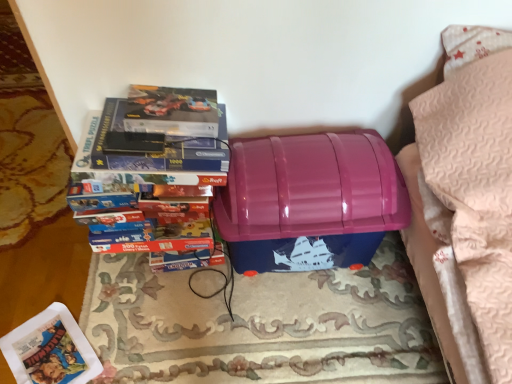
This screenshot has height=384, width=512. Describe the element at coordinates (153, 189) in the screenshot. I see `blue cardboard puzzle at left` at that location.

The image size is (512, 384). I want to click on glossy plastic storage box at center, so click(x=309, y=201).

Based on the photo, from the image's perspective, which object appears higher, blue cardboard puzzle at left or rug/carpet at center?

blue cardboard puzzle at left is shown above in the image.

Can you confirm if blue cardboard puzzle at left is smaller than rug/carpet at center?

No, blue cardboard puzzle at left is not smaller than rug/carpet at center.

Which is farther, (196, 215) or (194, 359)?

The point (194, 359) is more distant.

Is blue cardboard puzzle at left not inside rug/carpet at center?

blue cardboard puzzle at left is positioned outside rug/carpet at center.

Is matte plastic paperback book at lower left shorter than glossy plastic storage box at center?

Indeed, matte plastic paperback book at lower left has a lesser height compared to glossy plastic storage box at center.

From the picture: Does matte plastic paperback book at lower left come behind glossy plastic storage box at center?

Yes, it is behind glossy plastic storage box at center.

Which of these two, matte plastic paperback book at lower left or glossy plastic storage box at center, is wider?

Wider between the two is glossy plastic storage box at center.

How distant is matte plastic paperback book at lower left from glossy plastic storage box at center?

matte plastic paperback book at lower left and glossy plastic storage box at center are 72.64 centimeters apart from each other.

Is rug/carpet at center shorter than glossy plastic storage box at center?

Correct, rug/carpet at center is not as tall as glossy plastic storage box at center.

Does point (362, 319) come behind point (227, 237)?

Yes, point (362, 319) is farther from viewer.

Is rug/carpet at center aimed at glossy plastic storage box at center?

No, rug/carpet at center is not aimed at glossy plastic storage box at center.

From a real-world perspective, who is located higher, matte plastic paperback book at lower left or rug/carpet at center?

From a 3D spatial view, rug/carpet at center is above.

Does matte plastic paperback book at lower left have a smaller size compared to rug/carpet at center?

Indeed, matte plastic paperback book at lower left has a smaller size compared to rug/carpet at center.

Considering their positions, is matte plastic paperback book at lower left located in front of or behind rug/carpet at center?

Visually, matte plastic paperback book at lower left is located behind rug/carpet at center.

Is point (293, 159) positioned after point (362, 297)?

That is False.

Is glossy plastic storage box at center situated inside rug/carpet at center or outside?

glossy plastic storage box at center exists outside the volume of rug/carpet at center.

Between glossy plastic storage box at center and rug/carpet at center, which one has more height?

Standing taller between the two is glossy plastic storage box at center.

Which object is more forward, glossy plastic storage box at center or rug/carpet at center?

Positioned in front is glossy plastic storage box at center.

Does point (156, 243) appear closer or farther from the camera than point (373, 165)?

Point (156, 243).

From a real-world perspective, between blue cardboard puzzle at left and glossy plastic storage box at center, who is vertically higher?

blue cardboard puzzle at left, from a real-world perspective.

From the image's perspective, which one is positioned higher, blue cardboard puzzle at left or glossy plastic storage box at center?

blue cardboard puzzle at left.

Looking at this image, does rug/carpet at center have a larger size compared to blue cardboard puzzle at left?

No.

Can you see rug/carpet at center touching blue cardboard puzzle at left?

No, rug/carpet at center is not making contact with blue cardboard puzzle at left.

Between point (360, 276) and point (93, 159), which one is positioned behind?

The point (360, 276) is farther from the camera.

Can you tell me how much rug/carpet at center and blue cardboard puzzle at left differ in facing direction?

rug/carpet at center and blue cardboard puzzle at left are facing 179 degrees away from each other.

This screenshot has width=512, height=384. Find the location of `mat that is behind the blue cardboard puzzle at left`. mat that is behind the blue cardboard puzzle at left is located at coordinates (262, 325).

Identify the location of paperback book on the left side of glossy plastic storage box at center. The image size is (512, 384). (50, 350).

From the image, which object appears to be nearer to glossy plastic storage box at center, matte plastic paperback book at lower left or rug/carpet at center?

Based on the image, rug/carpet at center appears to be nearer to glossy plastic storage box at center.

Looking at the image, which one is located closer to glossy plastic storage box at center, rug/carpet at center or blue cardboard puzzle at left?

blue cardboard puzzle at left is positioned closer to the anchor glossy plastic storage box at center.

Based on their spatial positions, is blue cardboard puzzle at left or rug/carpet at center closer to matte plastic paperback book at lower left?

rug/carpet at center.

Looking at the image, which one is located further to glossy plastic storage box at center, matte plastic paperback book at lower left or blue cardboard puzzle at left?

The object further to glossy plastic storage box at center is matte plastic paperback book at lower left.

Looking at the image, which one is located closer to glossy plastic storage box at center, rug/carpet at center or matte plastic paperback book at lower left?

rug/carpet at center lies closer to glossy plastic storage box at center than the other object.

Which object lies further to the anchor point rug/carpet at center, matte plastic paperback book at lower left or blue cardboard puzzle at left?

matte plastic paperback book at lower left is further to rug/carpet at center.

Based on their spatial positions, is glossy plastic storage box at center or rug/carpet at center further from blue cardboard puzzle at left?

The object further to blue cardboard puzzle at left is rug/carpet at center.

From the image, which object appears to be farther from glossy plastic storage box at center, blue cardboard puzzle at left or rug/carpet at center?

rug/carpet at center is positioned further to the anchor glossy plastic storage box at center.

The width and height of the screenshot is (512, 384). What are the coordinates of `mat located between blue cardboard puzzle at left and glossy plastic storage box at center in the left-right direction` in the screenshot? It's located at (262, 325).

Where is `mat between blue cardboard puzzle at left and matte plastic paperback book at lower left vertically`? This screenshot has width=512, height=384. mat between blue cardboard puzzle at left and matte plastic paperback book at lower left vertically is located at coordinates (262, 325).

Identify the location of book between matte plastic paperback book at lower left and glossy plastic storage box at center. The height and width of the screenshot is (384, 512). (153, 189).

Where is `mat located between matte plastic paperback book at lower left and glossy plastic storage box at center in the left-right direction`? mat located between matte plastic paperback book at lower left and glossy plastic storage box at center in the left-right direction is located at coordinates (262, 325).